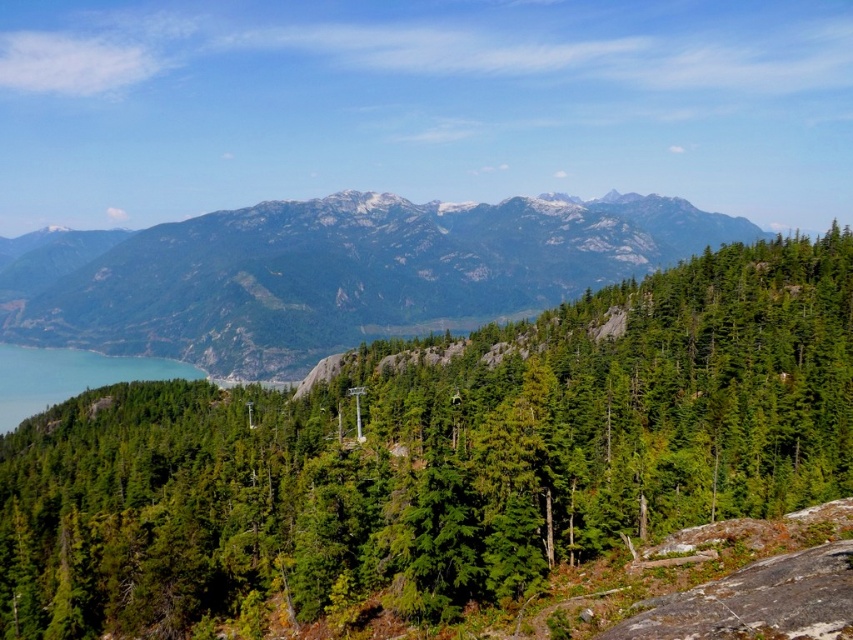
Question: Does green matte tree at center have a smaller size compared to green rocky mountain at center?

Choices:
 (A) no
 (B) yes

Answer: (B)

Question: Does green matte tree at center appear over green rocky mountain at center?

Choices:
 (A) yes
 (B) no

Answer: (B)

Question: Among these points, which one is nearest to the camera?

Choices:
 (A) (782, 353)
 (B) (190, 339)

Answer: (A)

Question: Among these points, which one is nearest to the camera?

Choices:
 (A) (125, 352)
 (B) (566, 424)

Answer: (B)

Question: Which point is closer to the camera?

Choices:
 (A) (317, 240)
 (B) (555, 365)

Answer: (B)

Question: Can you confirm if green matte tree at center is positioned above green rocky mountain at center?

Choices:
 (A) yes
 (B) no

Answer: (B)